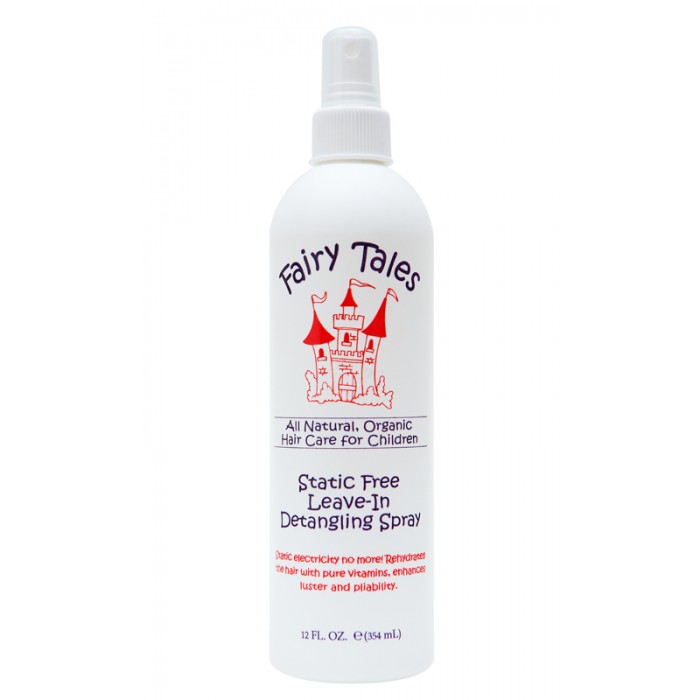
Locate an element on the screen. The image size is (700, 700). white spray bottle is located at coordinates (390, 201).